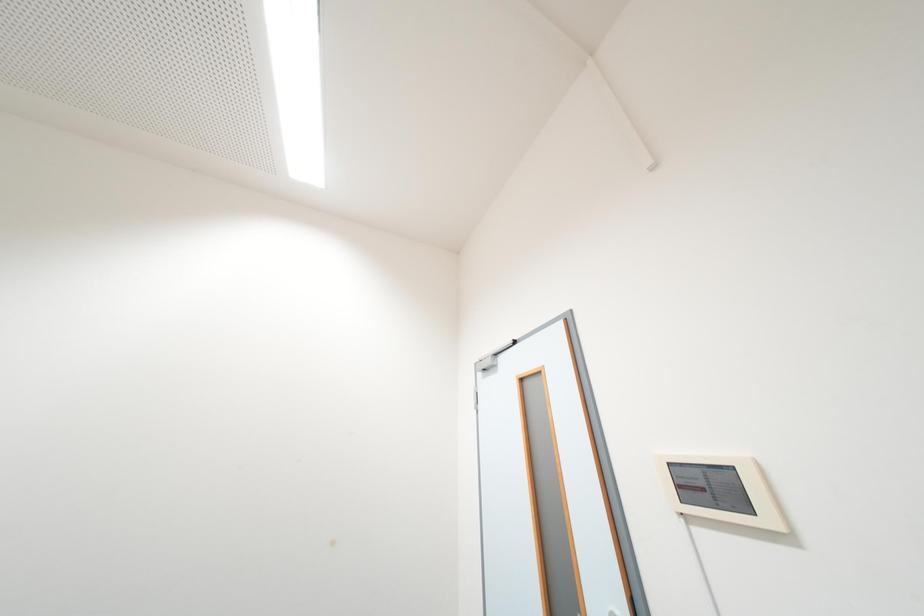
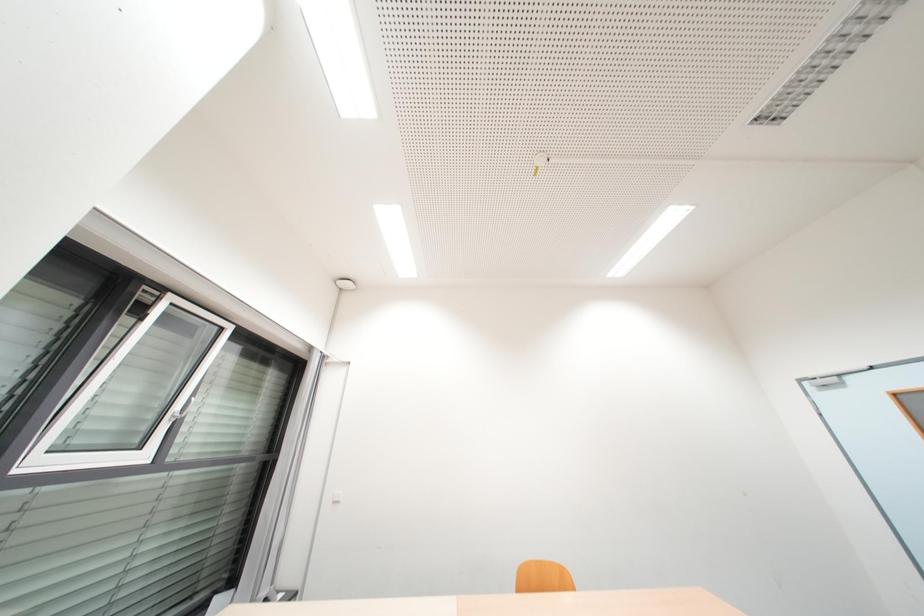
Which direction would the cameraman need to move to produce the second image?

The cameraman moved toward left, backward.